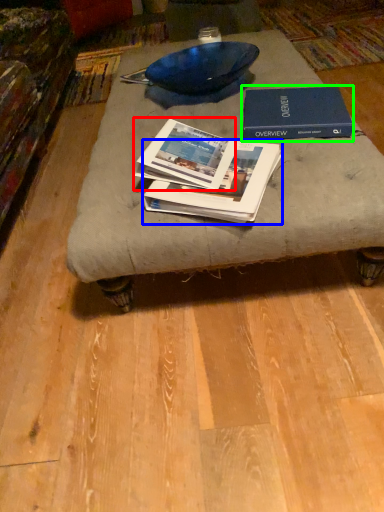
Question: Which object is positioned farthest from book (highlighted by a red box)? Select from book (highlighted by a blue box) and book (highlighted by a green box).

Choices:
 (A) book
 (B) book

Answer: (B)